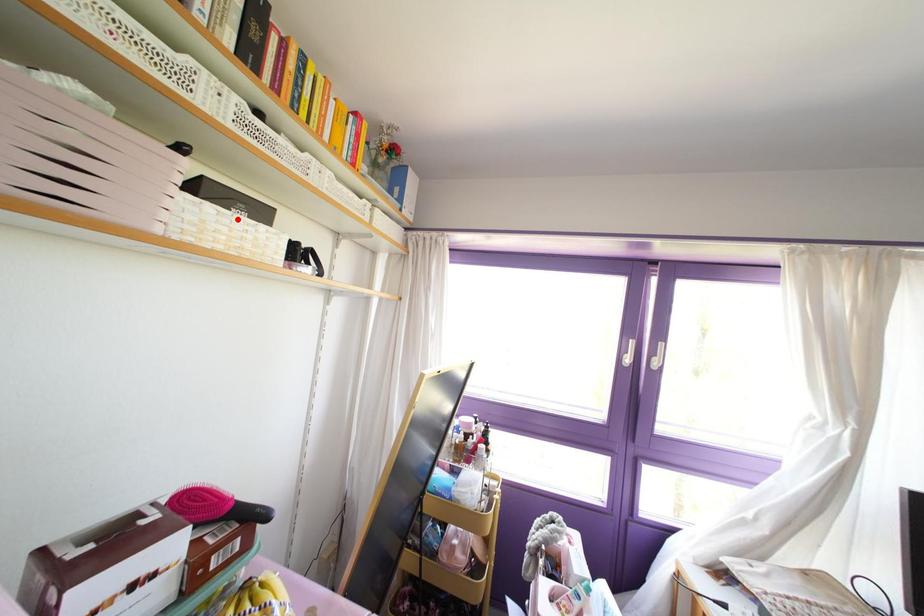
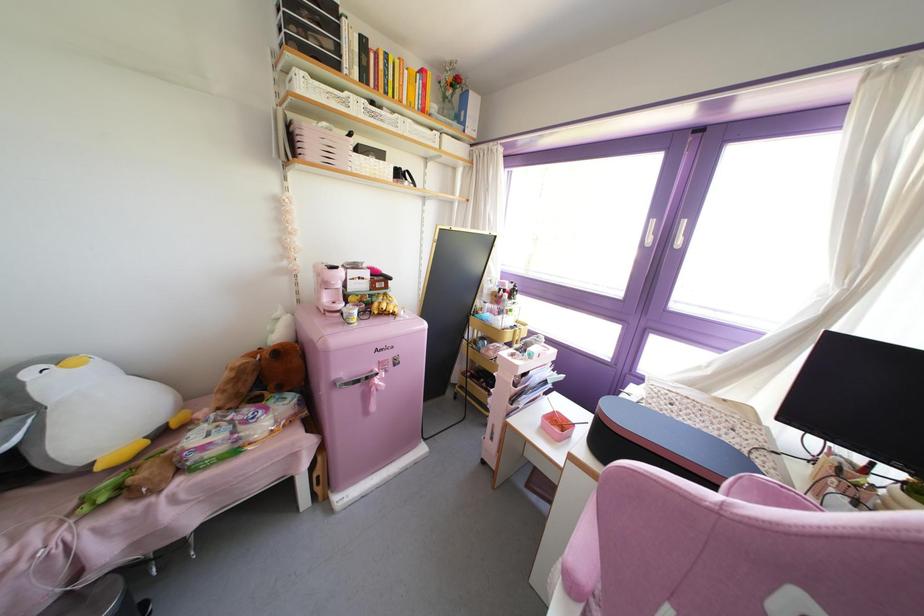
In the second image, find the point that corresponds to the highlighted location in the first image.

(371, 160)